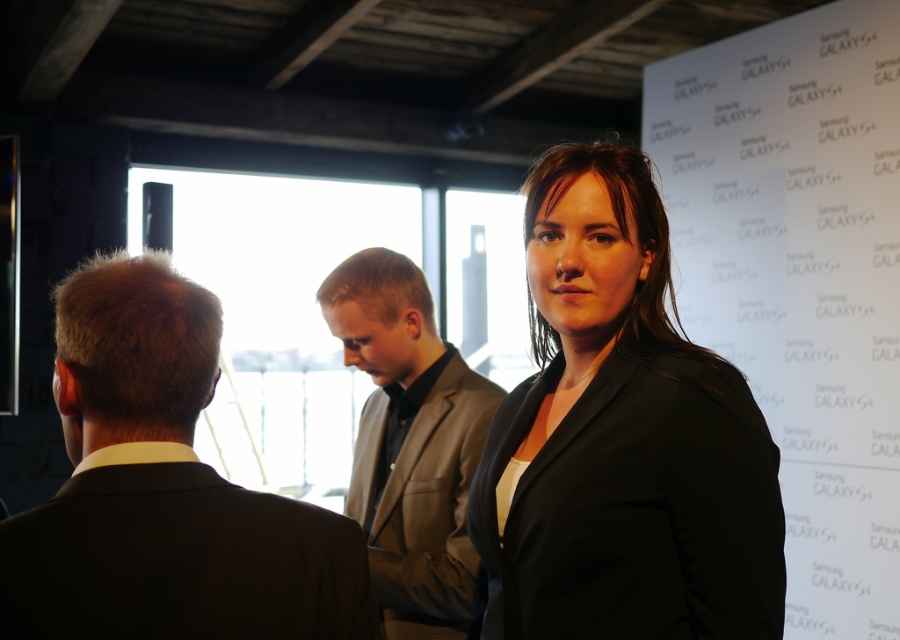
Who is shorter, black matte blazer at center or gray matte suit at center?

black matte blazer at center is shorter.

Can you confirm if black matte blazer at center is shorter than gray matte suit at center?

Yes.

Between point (604, 324) and point (448, 364), which one is positioned behind?

The point (448, 364) is more distant.

At what (x,y) coordinates should I click in order to perform the action: click on black matte blazer at center. Please return your answer as a coordinate pair (x, y). The height and width of the screenshot is (640, 900). Looking at the image, I should click on (621, 438).

Which is below, black suit at left or gray matte suit at center?

gray matte suit at center is below.

Can you confirm if black suit at left is positioned below gray matte suit at center?

No, black suit at left is not below gray matte suit at center.

At what (x,y) coordinates should I click in order to perform the action: click on black suit at left. Please return your answer as a coordinate pair (x, y). Image resolution: width=900 pixels, height=640 pixels. Looking at the image, I should click on (163, 490).

The image size is (900, 640). I want to click on black suit at left, so click(x=163, y=490).

Between black matte blazer at center and black suit at left, which one has less height?

With less height is black suit at left.

What do you see at coordinates (621, 438) in the screenshot?
I see `black matte blazer at center` at bounding box center [621, 438].

Is point (550, 541) positioned in front of point (199, 561)?

No, (550, 541) is further to viewer.

You are a GUI agent. You are given a task and a screenshot of the screen. Output one action in this format:
    pyautogui.click(x=<x>, y=<y>)
    Task: Click on the black matte blazer at center
    
    Given the screenshot: What is the action you would take?
    pyautogui.click(x=621, y=438)